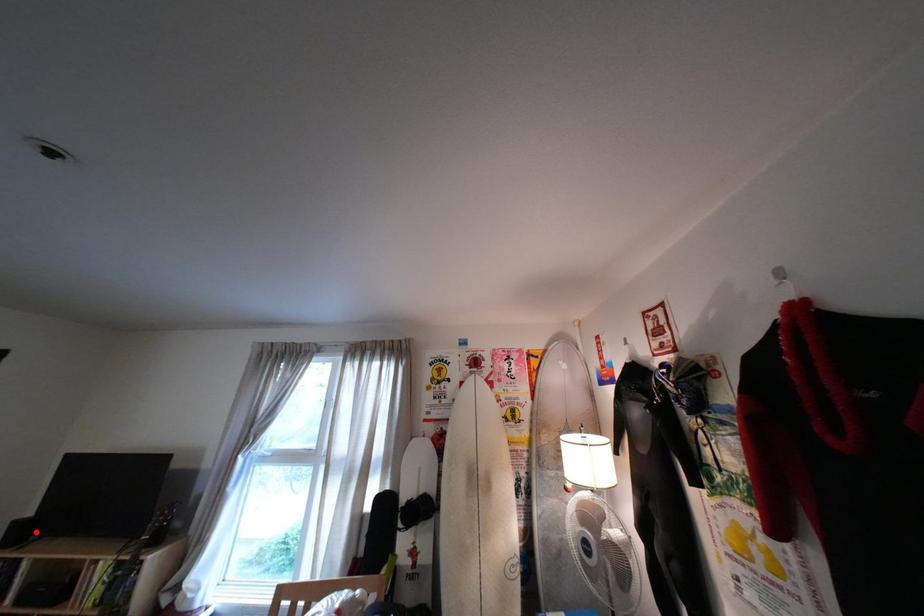
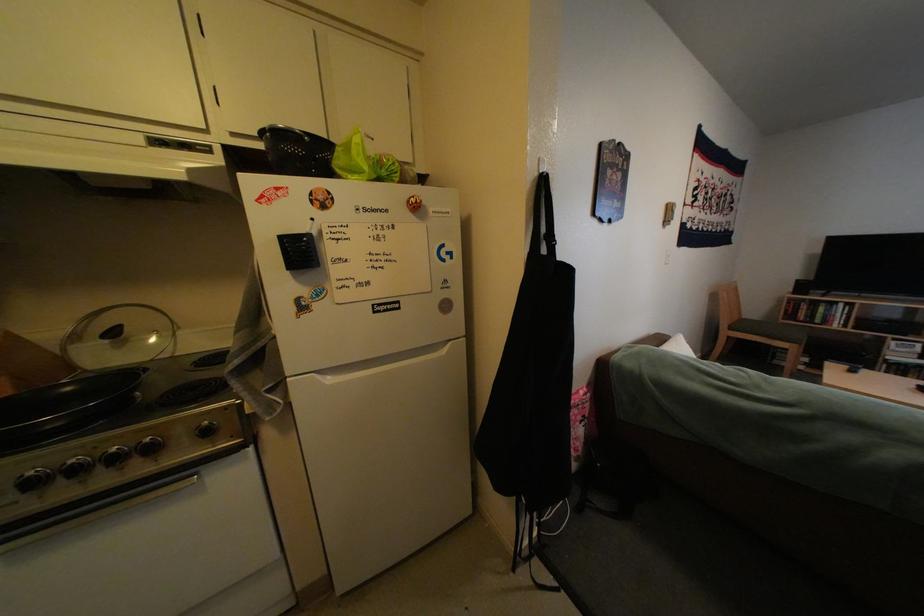
The point at the highlighted location is marked in the first image. Where is the corresponding point in the second image?

(816, 288)